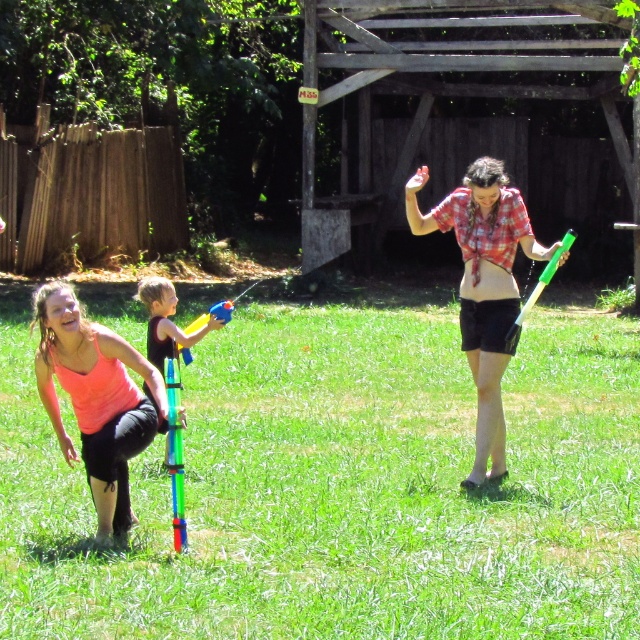
Is green grass at center above plaid shirt at center?

Actually, green grass at center is below plaid shirt at center.

Does green grass at center have a lesser width compared to plaid shirt at center?

Incorrect, green grass at center's width is not less than plaid shirt at center's.

Which is in front, point (570, 465) or point (481, 400)?

Point (481, 400) is in front.

Locate an element on the screen. The height and width of the screenshot is (640, 640). green grass at center is located at coordinates pos(342,488).

This screenshot has width=640, height=640. What do you see at coordinates (97, 400) in the screenshot? I see `pink matte tank top at lower left` at bounding box center [97, 400].

Which is in front, point (131, 348) or point (506, 250)?

Point (131, 348)

Locate an element on the screen. The height and width of the screenshot is (640, 640). pink matte tank top at lower left is located at coordinates (97, 400).

Between pink matte tank top at lower left and translucent plastic water gun at center, which one is positioned lower?

pink matte tank top at lower left

Between pink matte tank top at lower left and translucent plastic water gun at center, which one has more height?

Standing taller between the two is pink matte tank top at lower left.

Which is behind, point (138, 362) or point (211, 321)?

Point (211, 321)

Find the location of a particular element. pink matte tank top at lower left is located at coordinates (97, 400).